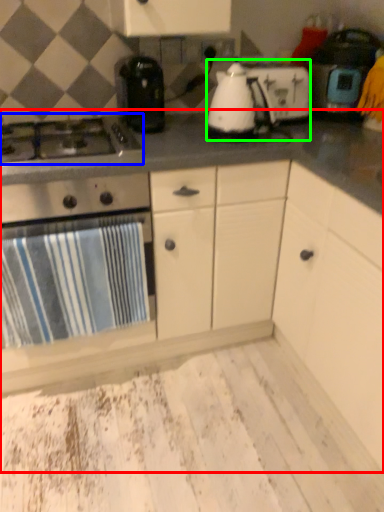
Question: Which object is positioned farthest from countertop (highlighted by a red box)? Select from gas stove (highlighted by a blue box) and kitchen appliance (highlighted by a green box).

Choices:
 (A) gas stove
 (B) kitchen appliance

Answer: (A)